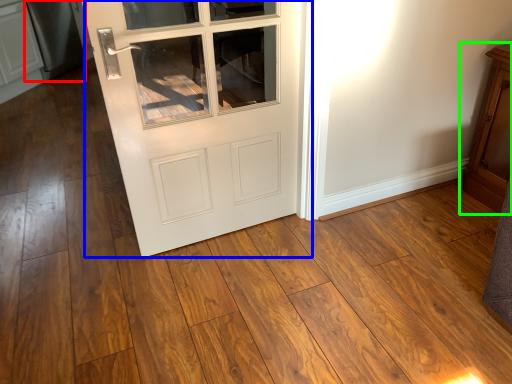
Question: Based on their relative distances, which object is farther from appliance (highlighted by a red box)? Choose from door (highlighted by a blue box) and dresser (highlighted by a green box).

Choices:
 (A) door
 (B) dresser

Answer: (B)